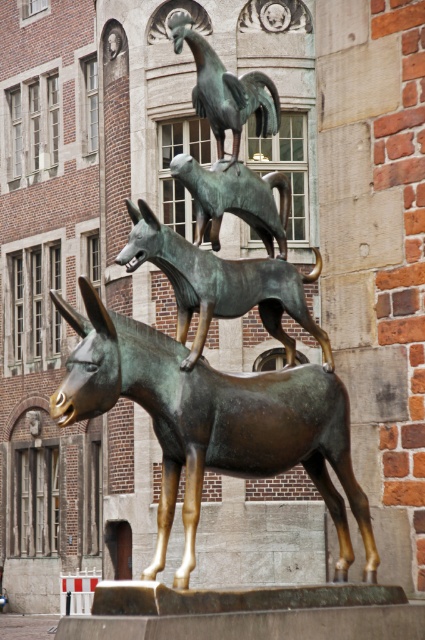
Is bronze/golden donkey at center thinner than bronze rooster at upper center?

No.

Which is in front, point (249, 387) or point (257, 132)?

Point (249, 387)

Image resolution: width=425 pixels, height=640 pixels. What are the coordinates of `bronze/golden donkey at center` in the screenshot? It's located at (212, 420).

Does bronze dog at center appear on the left side of bronze donkey at center?

No, bronze dog at center is not to the left of bronze donkey at center.

Looking at this image, can you confirm if bronze dog at center is taller than bronze donkey at center?

Incorrect, bronze dog at center's height is not larger of bronze donkey at center's.

Describe the element at coordinates (221, 284) in the screenshot. I see `bronze dog at center` at that location.

This screenshot has width=425, height=640. What are the coordinates of `bronze dog at center` in the screenshot? It's located at (221, 284).

Who is more distant from viewer, (101,301) or (221,298)?

Point (101,301)

Image resolution: width=425 pixels, height=640 pixels. What do you see at coordinates (212, 420) in the screenshot? I see `bronze/golden donkey at center` at bounding box center [212, 420].

Does point (320, 388) come in front of point (130, 244)?

That is False.

In order to click on bronze/golden donkey at center in this screenshot , I will do `click(212, 420)`.